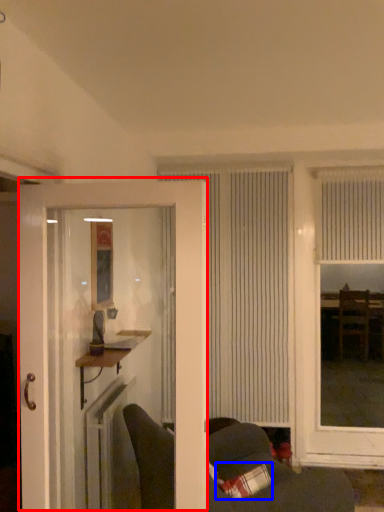
Question: Which object is further to the camera taking this photo, door (highlighted by a red box) or pillow (highlighted by a blue box)?

Choices:
 (A) door
 (B) pillow

Answer: (B)